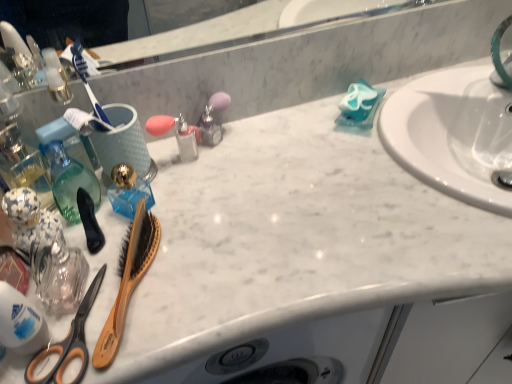
This screenshot has height=384, width=512. Identify the location of vacant area that lies between blue matte soap at upper right, acting as the 2th cleaning product starting from the front, and translucent purple bottle at center. (291, 127).